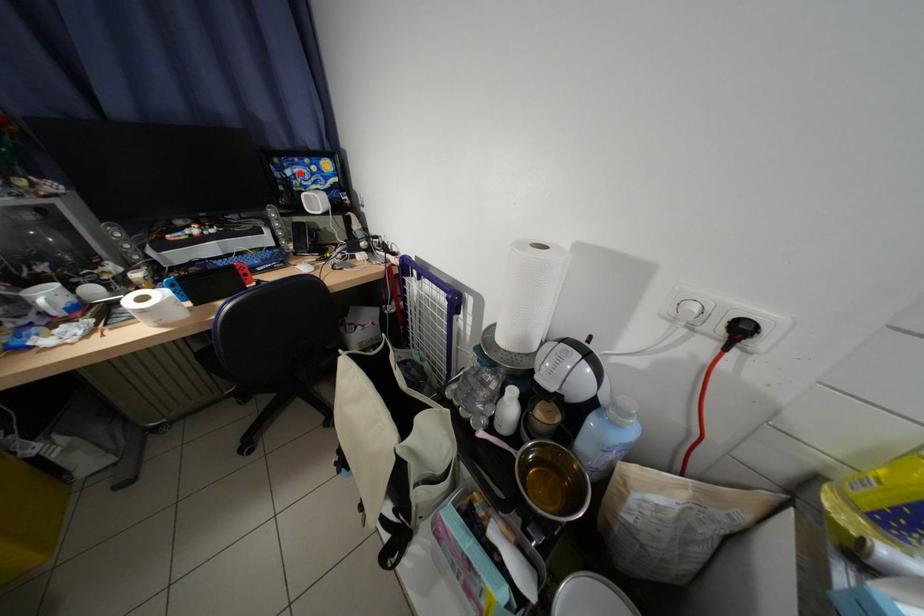
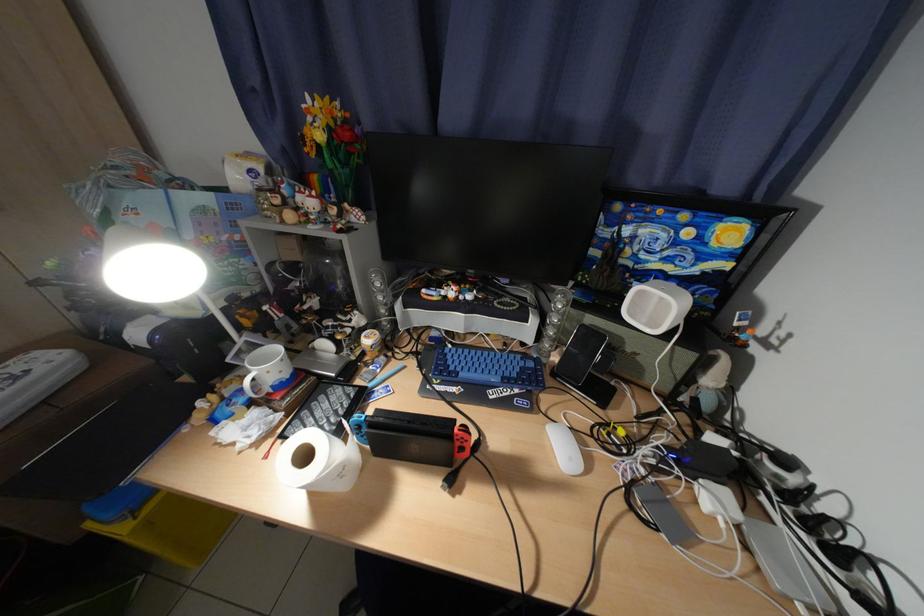
Find the pixel in the second image that matches the highlighted location in the first image.

(638, 233)